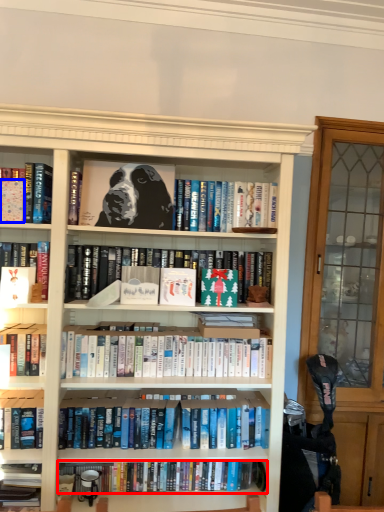
Question: Among these objects, which one is nearest to the camera, book (highlighted by a red box) or paperback book (highlighted by a blue box)?

Choices:
 (A) book
 (B) paperback book

Answer: (B)